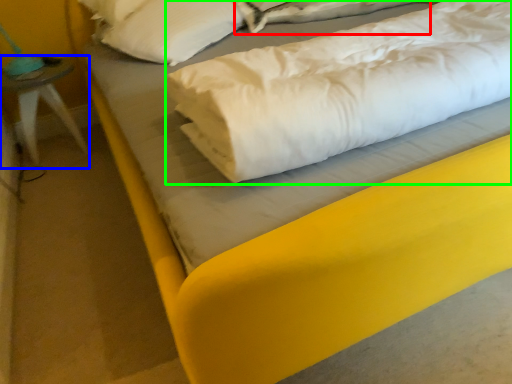
Question: Which is farther away from sheet (highlighted by a red box)? furniture (highlighted by a blue box) or linen (highlighted by a green box)?

Choices:
 (A) furniture
 (B) linen

Answer: (A)